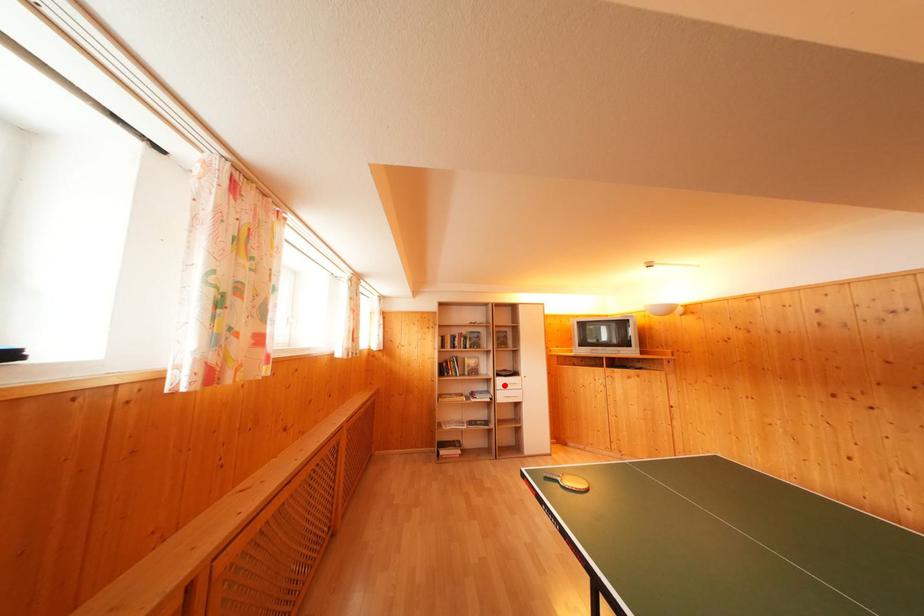
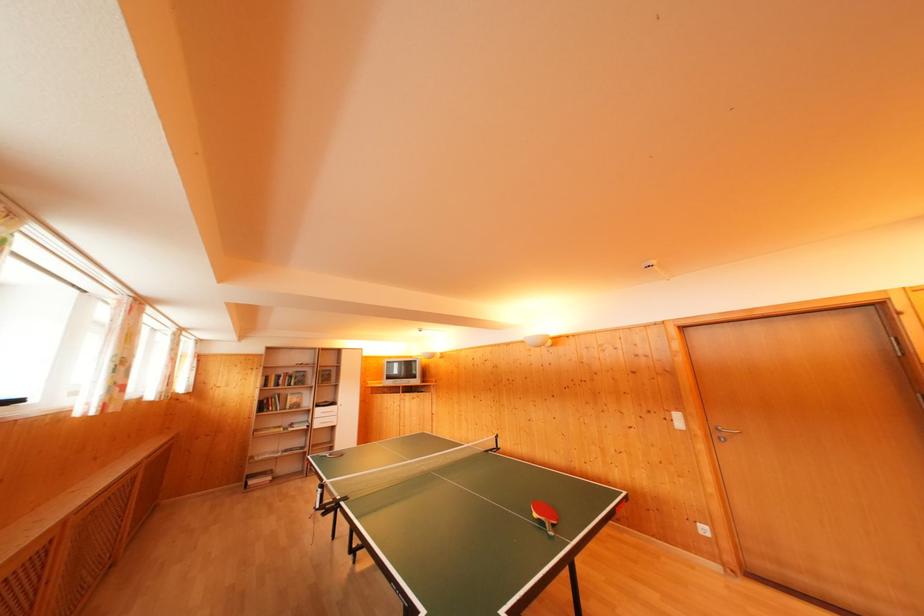
The point at the highlighted location is marked in the first image. Where is the corresponding point in the second image?

(322, 416)